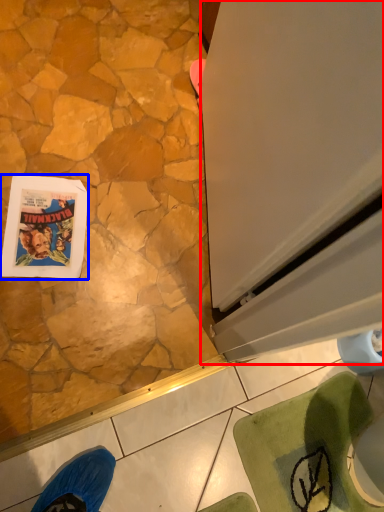
Question: Which point is further to the camera, screen door (highlighted by a red box) or comic book (highlighted by a blue box)?

Choices:
 (A) screen door
 (B) comic book

Answer: (B)